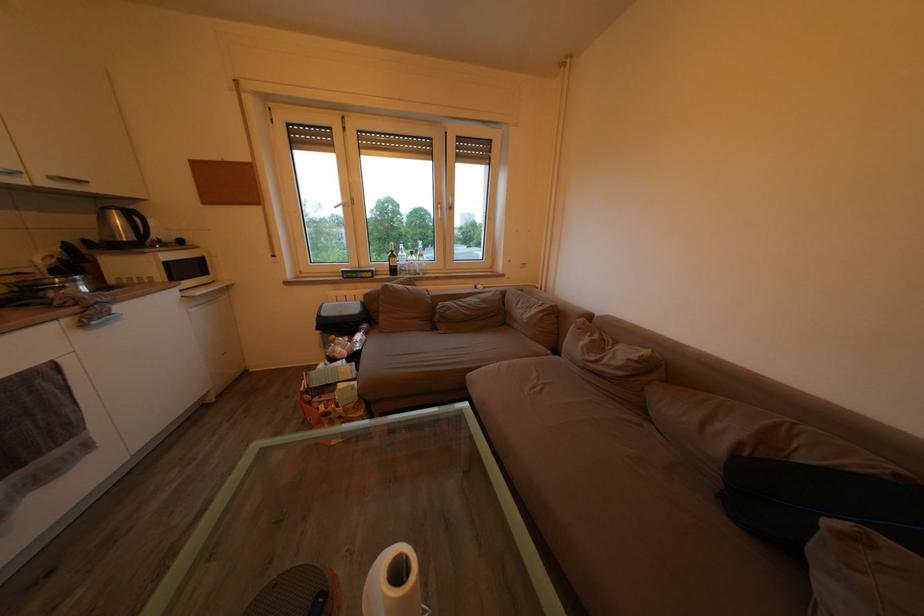
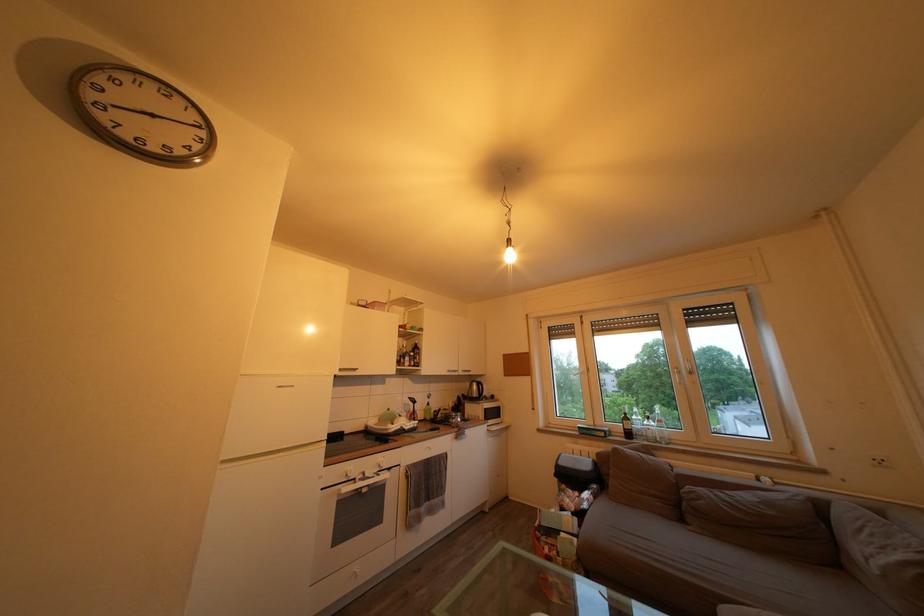
The point at (127, 227) is marked in the first image. Where is the corresponding point in the second image?

(482, 392)